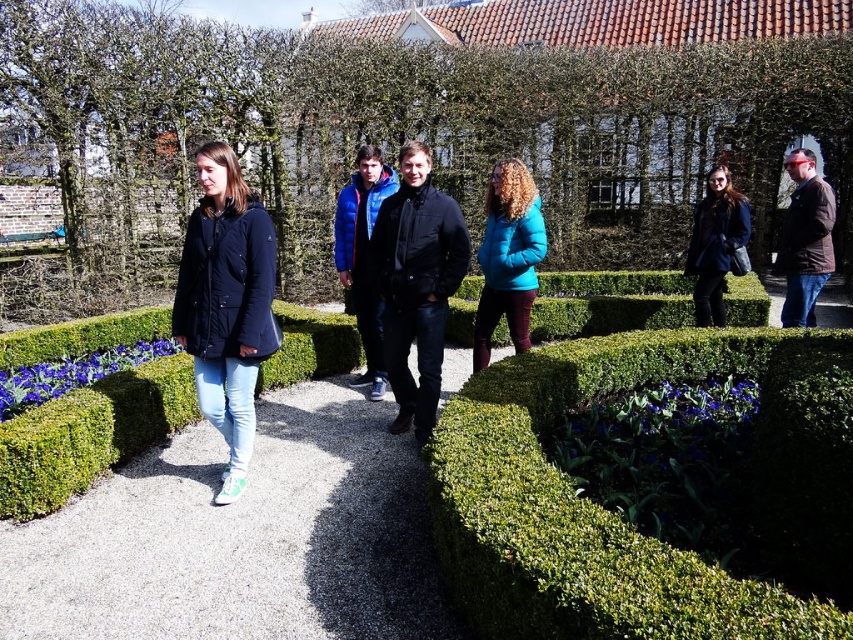
This screenshot has height=640, width=853. Identify the location of green leafy hedge at center. (624, 520).

Is green leafy hedge at center bigger than blue down jacket at center?

Indeed, green leafy hedge at center has a larger size compared to blue down jacket at center.

This screenshot has height=640, width=853. What do you see at coordinates (624, 520) in the screenshot?
I see `green leafy hedge at center` at bounding box center [624, 520].

The width and height of the screenshot is (853, 640). What are the coordinates of `green leafy hedge at center` in the screenshot? It's located at (624, 520).

Between green leafy hedge at center and matte black coat at center, which one is positioned higher?

matte black coat at center is above.

Is green leafy hedge at center below matte black coat at center?

Indeed, green leafy hedge at center is positioned under matte black coat at center.

This screenshot has width=853, height=640. What do you see at coordinates (624, 520) in the screenshot?
I see `green leafy hedge at center` at bounding box center [624, 520].

The image size is (853, 640). I want to click on green leafy hedge at center, so click(624, 520).

Which is above, green hedge at center or teal matte jacket at center?

teal matte jacket at center is higher up.

Can you confirm if green hedge at center is taller than teal matte jacket at center?

Yes.

Between point (685, 307) and point (508, 179), which one is positioned behind?

Positioned behind is point (685, 307).

Where is `green hedge at center`? The width and height of the screenshot is (853, 640). green hedge at center is located at coordinates (90, 435).